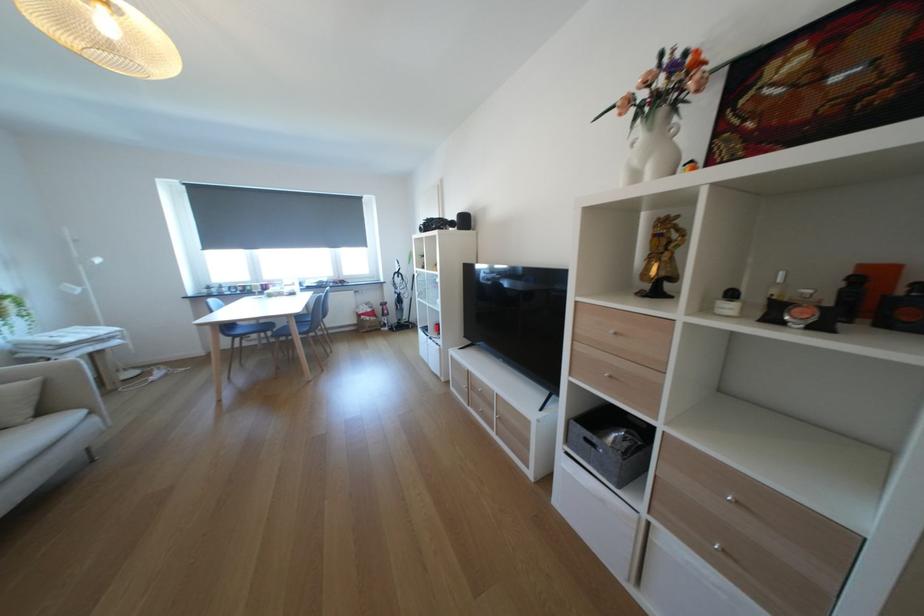
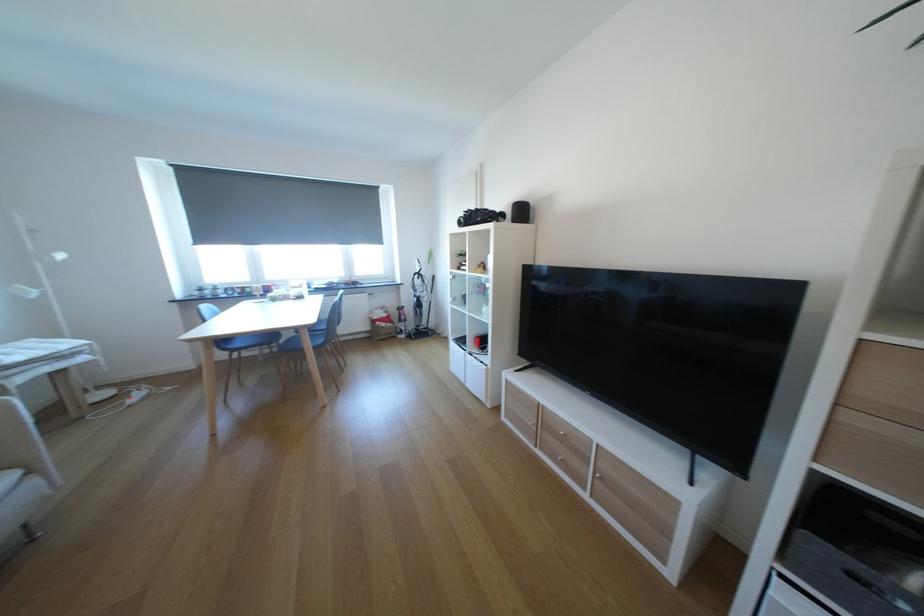
Where in the second image is the point corresponding to [106,419] from the first image?

(45, 483)